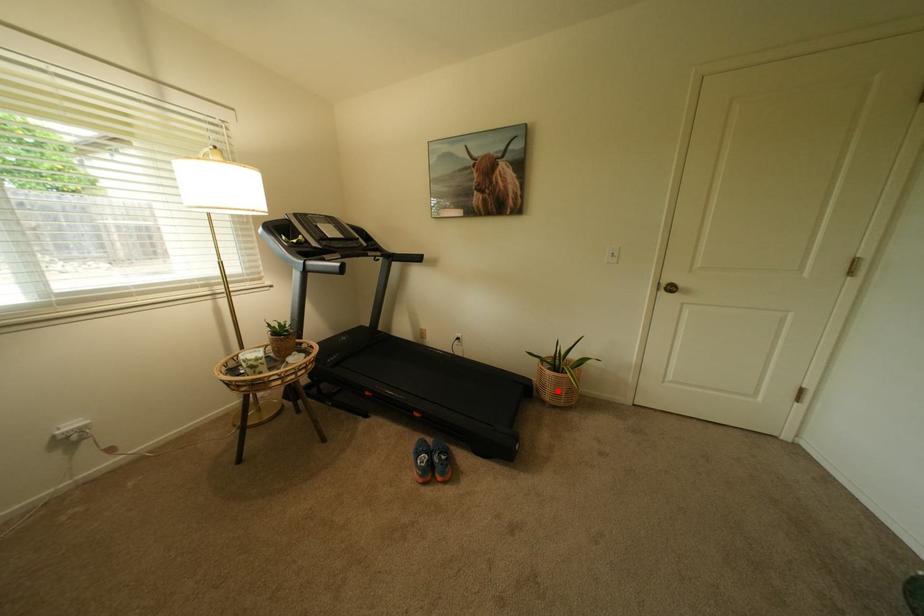
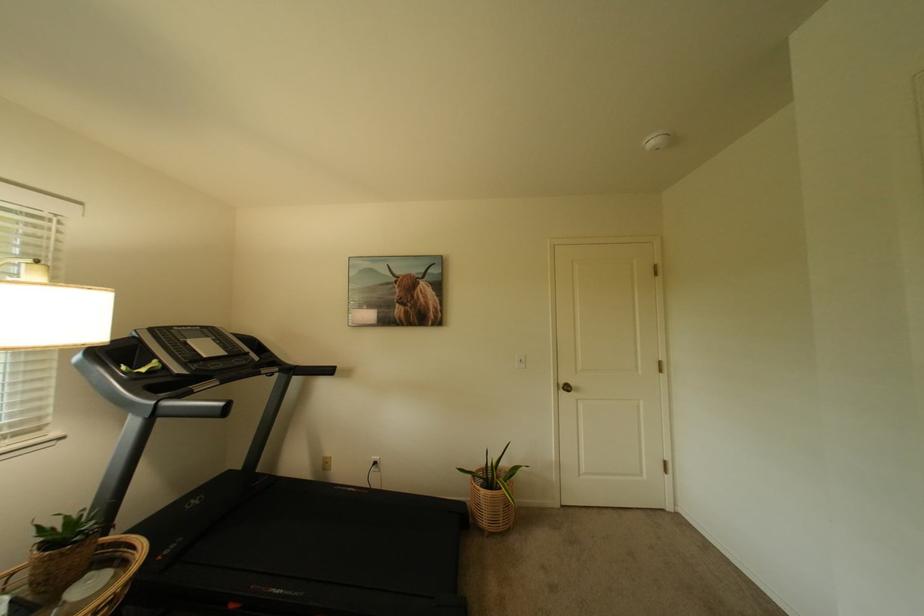
In the second image, find the point that corresponds to the highlighted location in the first image.

(495, 515)